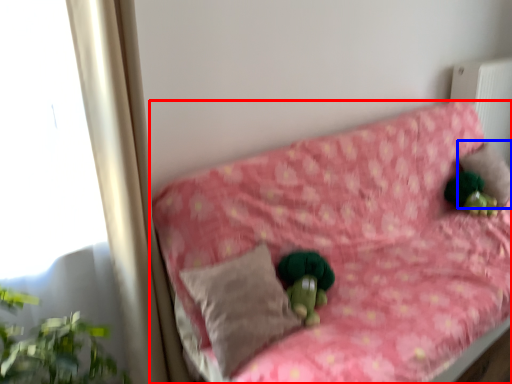
Question: Which of the following is the closest to the observer, furniture (highlighted by a red box) or pillow (highlighted by a blue box)?

Choices:
 (A) furniture
 (B) pillow

Answer: (A)